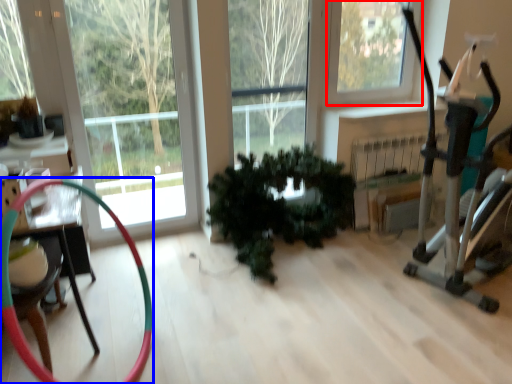
Question: Which of the following is the closest to the observer, window (highlighted by a red box) or garden hose (highlighted by a blue box)?

Choices:
 (A) window
 (B) garden hose

Answer: (B)